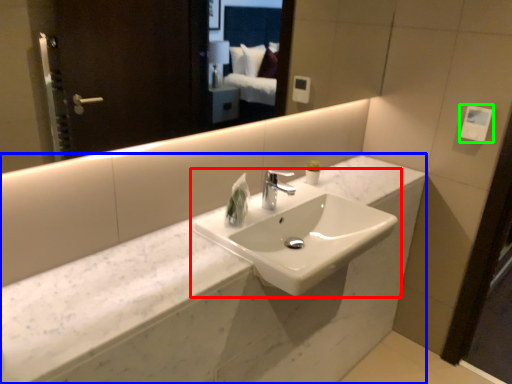
Question: Based on their relative distances, which object is farther from sink (highlighted by a red box)? Choose from counter (highlighted by a blue box) and hand dryer (highlighted by a green box).

Choices:
 (A) counter
 (B) hand dryer

Answer: (B)